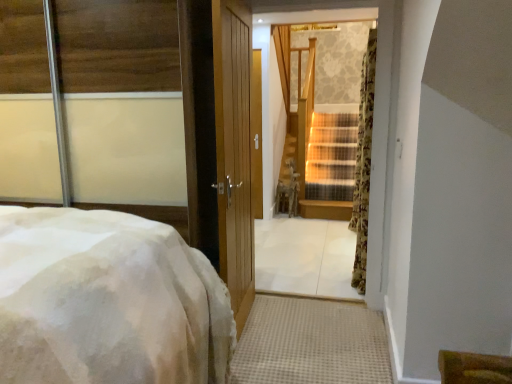
Question: Can you confirm if floral fabric curtain at right is wider than white fluffy bed at left?

Choices:
 (A) yes
 (B) no

Answer: (B)

Question: Does floral fabric curtain at right touch white fluffy bed at left?

Choices:
 (A) yes
 (B) no

Answer: (B)

Question: Does floral fabric curtain at right have a lesser height compared to white fluffy bed at left?

Choices:
 (A) no
 (B) yes

Answer: (A)

Question: Is floral fabric curtain at right to the right of white fluffy bed at left from the viewer's perspective?

Choices:
 (A) no
 (B) yes

Answer: (B)

Question: Is floral fabric curtain at right outside white fluffy bed at left?

Choices:
 (A) no
 (B) yes

Answer: (B)

Question: Is floral fabric curtain at right in front of or behind white fluffy bed at left in the image?

Choices:
 (A) behind
 (B) front

Answer: (A)

Question: Is floral fabric curtain at right inside the boundaries of white fluffy bed at left, or outside?

Choices:
 (A) inside
 (B) outside

Answer: (B)

Question: Considering the relative positions of floral fabric curtain at right and white fluffy bed at left in the image provided, is floral fabric curtain at right to the left or to the right of white fluffy bed at left?

Choices:
 (A) right
 (B) left

Answer: (A)

Question: Is floral fabric curtain at right bigger or smaller than white fluffy bed at left?

Choices:
 (A) big
 (B) small

Answer: (B)

Question: In terms of width, does white fluffy bed at left look wider or thinner when compared to wooden staircase at center?

Choices:
 (A) thin
 (B) wide

Answer: (B)

Question: Would you say white fluffy bed at left is inside or outside wooden staircase at center?

Choices:
 (A) inside
 (B) outside

Answer: (B)

Question: Does point (151, 377) appear closer or farther from the camera than point (329, 67)?

Choices:
 (A) closer
 (B) farther

Answer: (A)

Question: From a real-world perspective, is white fluffy bed at left physically located above or below wooden staircase at center?

Choices:
 (A) below
 (B) above

Answer: (A)

Question: In the image, is wooden staircase at center on the left side or the right side of white fluffy bed at left?

Choices:
 (A) right
 (B) left

Answer: (A)

Question: Is wooden staircase at center inside the boundaries of white fluffy bed at left, or outside?

Choices:
 (A) outside
 (B) inside

Answer: (A)